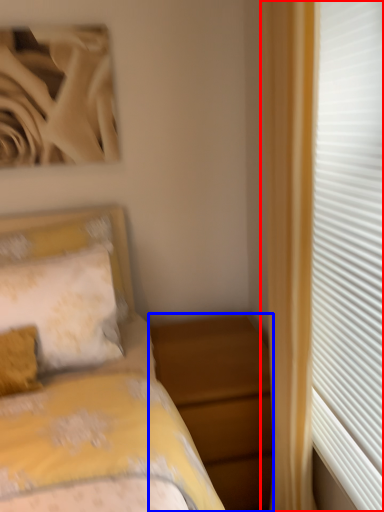
Question: Among these objects, which one is farthest to the camera, curtain (highlighted by a red box) or nightstand (highlighted by a blue box)?

Choices:
 (A) curtain
 (B) nightstand

Answer: (B)